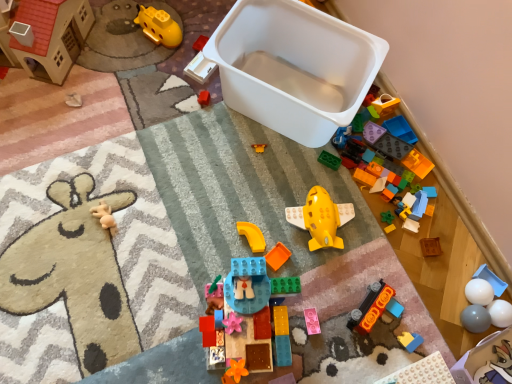
Locate an element on the screen. vacant area that lies to the right of orange matte car at lower right, marked as the 9th toy in a left-to-right arrangement is located at coordinates (411, 324).